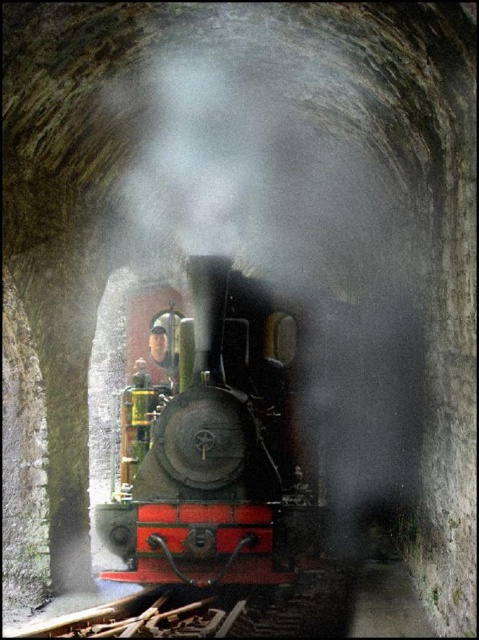
Between point (239, 305) and point (168, 355), which one is positioned behind?

Positioned behind is point (168, 355).

Where is `polished brass steam engine at center`? polished brass steam engine at center is located at coordinates (215, 449).

Between point (109, 502) and point (171, 365), which one is positioned behind?

The point (171, 365) is more distant.

The image size is (479, 640). In order to click on polished brass steam engine at center in this screenshot , I will do `click(215, 449)`.